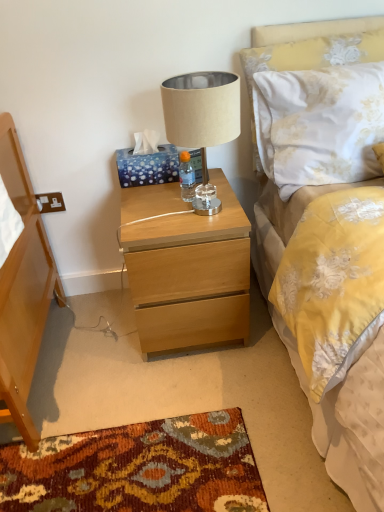
At what (x,y) coordinates should I click in order to perform the action: click on free point below beige fabric lampshade at center (from a real-world perspective). Please return your answer as a coordinate pair (x, y). Image resolution: width=384 pixels, height=512 pixels. Looking at the image, I should click on (204, 207).